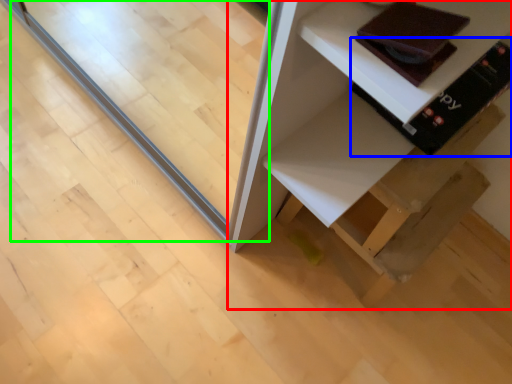
Question: Considering the real-world distances, which object is closest to furniture (highlighted by a red box)? book (highlighted by a blue box) or glass door (highlighted by a green box).

Choices:
 (A) book
 (B) glass door

Answer: (A)